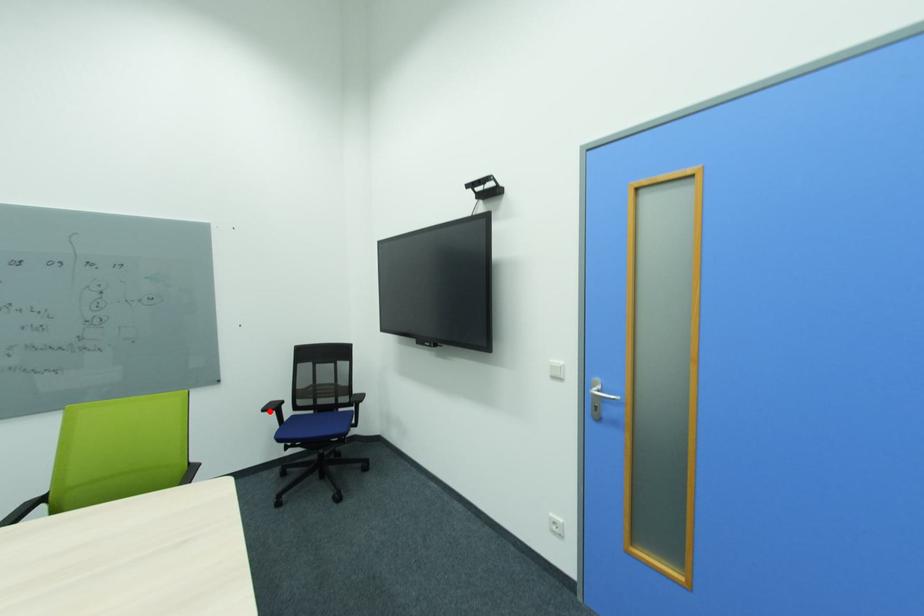
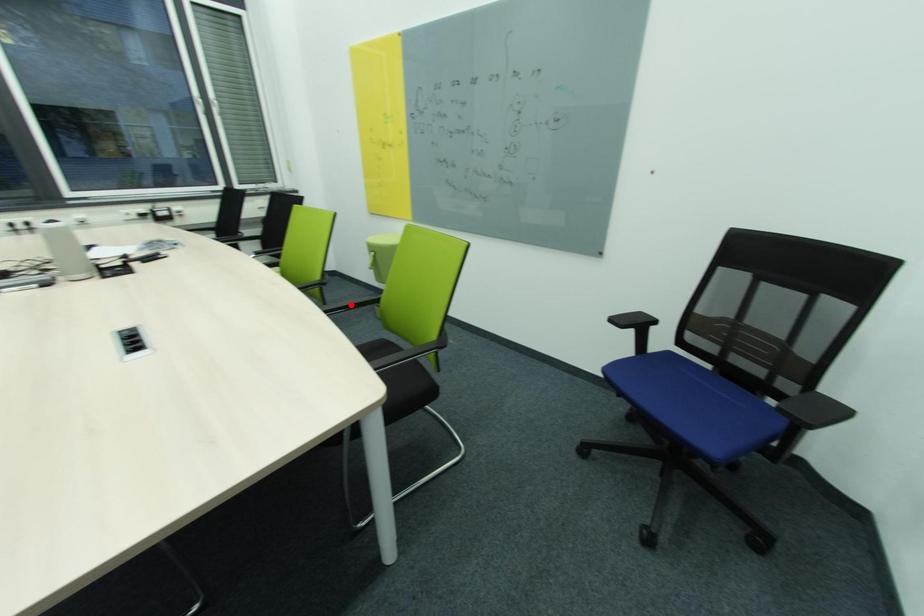
I am providing you with two images of the same scene from different viewpoints. A red point is marked on the first image and another point is marked on the second image. Is the marked point in image1 the same physical position as the marked point in image2?

No